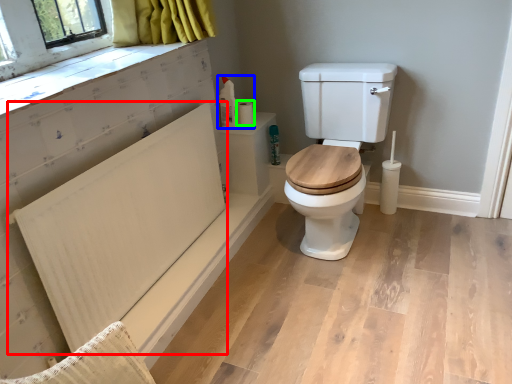
Question: Based on their relative distances, which object is nearer to radiator (highlighted by a red box)? Choose from toilet paper (highlighted by a blue box) and toilet paper (highlighted by a green box).

Choices:
 (A) toilet paper
 (B) toilet paper

Answer: (A)